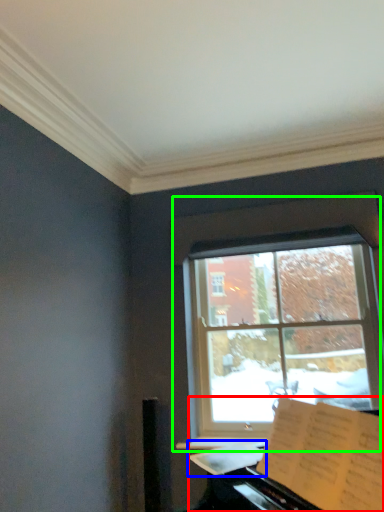
Question: Considering the real-world distances, which object is farthest from piano (highlighted by a red box)? sheet music (highlighted by a blue box) or window (highlighted by a green box)?

Choices:
 (A) sheet music
 (B) window

Answer: (B)